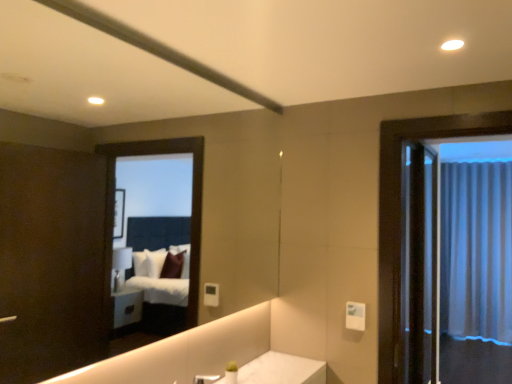
Question: Is silver metallic faucet at lower center looking in the opposite direction of white sheer curtain at right?

Choices:
 (A) no
 (B) yes

Answer: (A)

Question: Can you confirm if silver metallic faucet at lower center is shorter than white sheer curtain at right?

Choices:
 (A) no
 (B) yes

Answer: (B)

Question: From a real-world perspective, is silver metallic faucet at lower center on top of white sheer curtain at right?

Choices:
 (A) yes
 (B) no

Answer: (B)

Question: Can you confirm if silver metallic faucet at lower center is taller than white sheer curtain at right?

Choices:
 (A) no
 (B) yes

Answer: (A)

Question: Considering the relative positions of silver metallic faucet at lower center and white sheer curtain at right in the image provided, is silver metallic faucet at lower center to the left of white sheer curtain at right from the viewer's perspective?

Choices:
 (A) no
 (B) yes

Answer: (B)

Question: From the image's perspective, is silver metallic faucet at lower center located above or below white sheer curtain at right?

Choices:
 (A) above
 (B) below

Answer: (A)

Question: From a real-world perspective, is silver metallic faucet at lower center physically located above or below white sheer curtain at right?

Choices:
 (A) above
 (B) below

Answer: (B)

Question: In terms of height, does silver metallic faucet at lower center look taller or shorter compared to white sheer curtain at right?

Choices:
 (A) tall
 (B) short

Answer: (B)

Question: Considering the positions of point (196, 375) and point (445, 183), is point (196, 375) closer or farther from the camera than point (445, 183)?

Choices:
 (A) closer
 (B) farther

Answer: (A)

Question: Is white sheer curtain at right inside or outside of clear glass screen door at right?

Choices:
 (A) outside
 (B) inside

Answer: (A)

Question: Is white sheer curtain at right in front of or behind clear glass screen door at right in the image?

Choices:
 (A) behind
 (B) front

Answer: (A)

Question: Is white sheer curtain at right wider or thinner than clear glass screen door at right?

Choices:
 (A) wide
 (B) thin

Answer: (A)

Question: In the image, is white sheer curtain at right on the left side or the right side of clear glass screen door at right?

Choices:
 (A) right
 (B) left

Answer: (A)

Question: Looking at their shapes, would you say white sheer curtain at right is wider or thinner than silver metallic faucet at lower center?

Choices:
 (A) wide
 (B) thin

Answer: (A)

Question: Considering their positions, is white sheer curtain at right located in front of or behind silver metallic faucet at lower center?

Choices:
 (A) front
 (B) behind

Answer: (B)